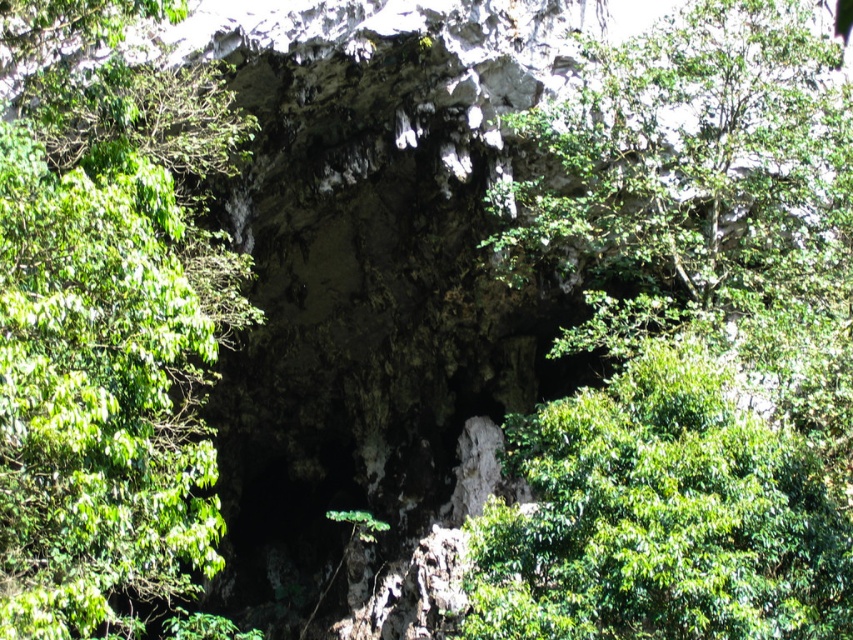
Question: Does green leafy tree at center come in front of green leafy tree at upper left?

Choices:
 (A) no
 (B) yes

Answer: (A)

Question: Can you confirm if green leafy tree at center is positioned to the left of green leafy tree at upper left?

Choices:
 (A) no
 (B) yes

Answer: (A)

Question: Is green leafy tree at center thinner than green leafy tree at upper left?

Choices:
 (A) no
 (B) yes

Answer: (A)